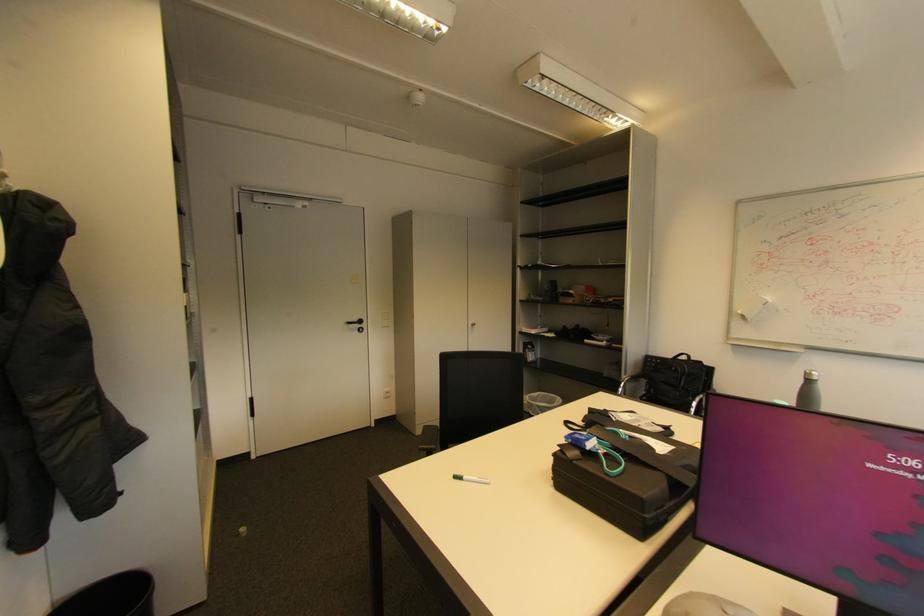
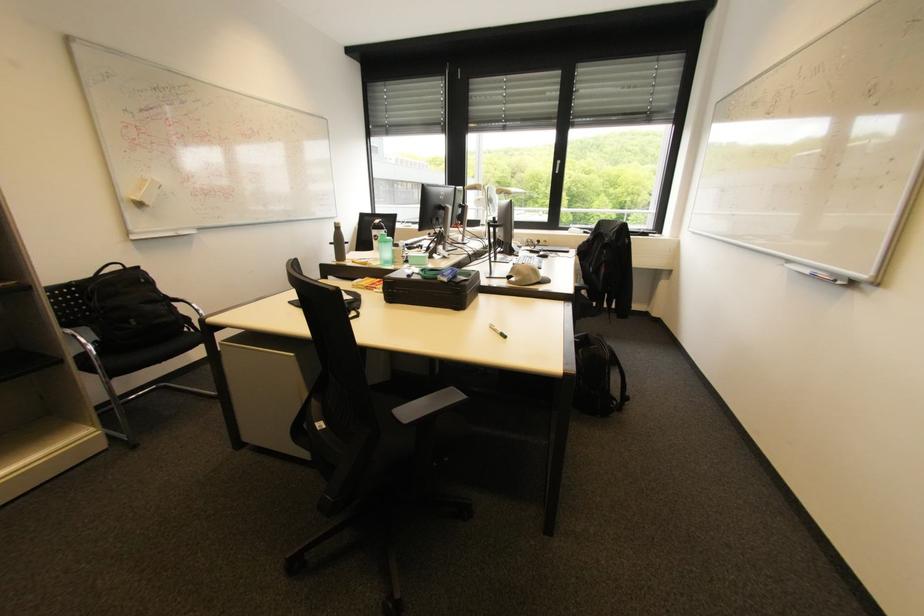
Where in the second image is the point corresponding to the point at 631,379 from the first image?

(74, 331)